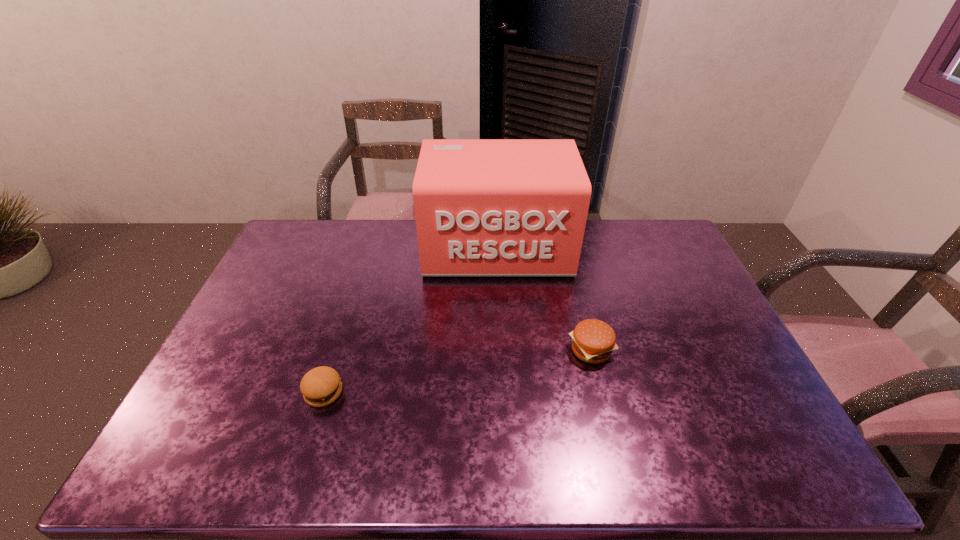
Locate an element on the screen. Image resolution: width=960 pixels, height=540 pixels. box is located at coordinates [483, 207].

Find the location of a particular element. the farthest object is located at coordinates (483, 207).

The height and width of the screenshot is (540, 960). Find the location of `the right hamburger`. the right hamburger is located at coordinates point(593,341).

In order to click on the second shortest object in this screenshot , I will do `click(593, 341)`.

The height and width of the screenshot is (540, 960). What are the coordinates of `the left hamburger` in the screenshot? It's located at (321, 386).

Where is `the shorter hamburger`? the shorter hamburger is located at coordinates point(321,386).

The width and height of the screenshot is (960, 540). In order to click on vacant space located on the surface of the farthest object where the text is embossed in this screenshot , I will do `click(503, 361)`.

Locate an element on the screen. vacant space located 0.090m on the front of the second farthest object is located at coordinates (602, 397).

I want to click on vacant space positioned 0.060m on the left of the nearest object, so click(281, 393).

Where is `object present at the far edge`? The height and width of the screenshot is (540, 960). object present at the far edge is located at coordinates (483, 207).